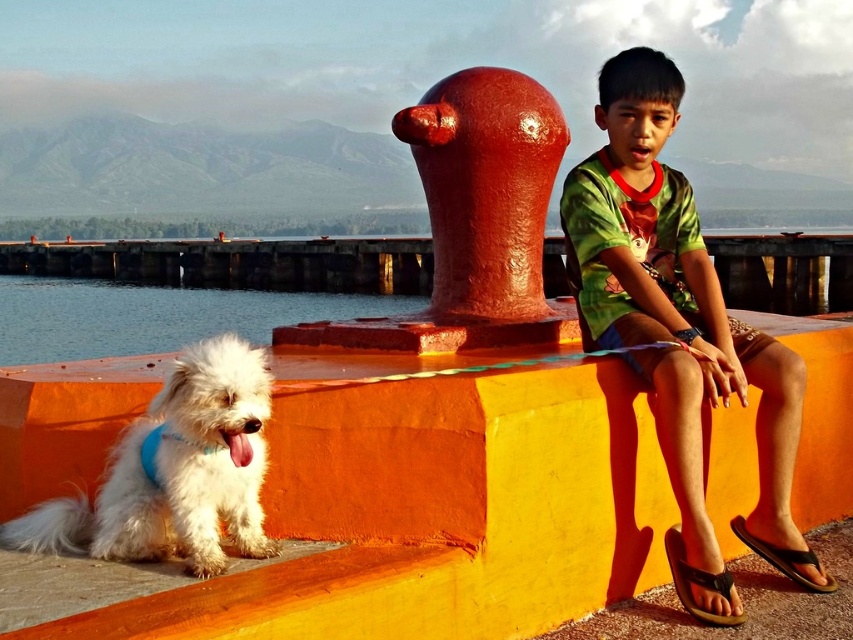
You are standing at point (434, 504) in the image. What object is located exactly at this coordinate?

The orange matte ledge at lower center is located exactly at point (434, 504).